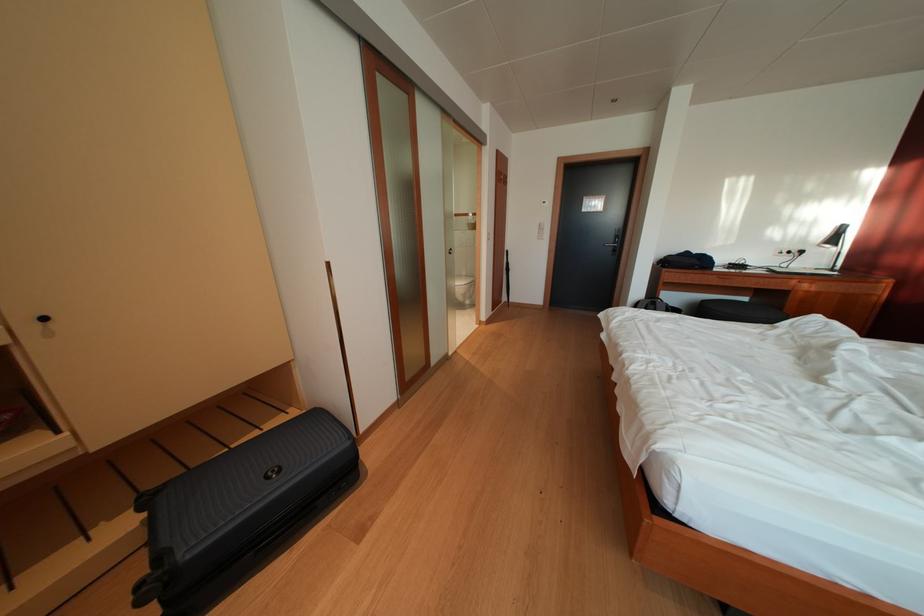
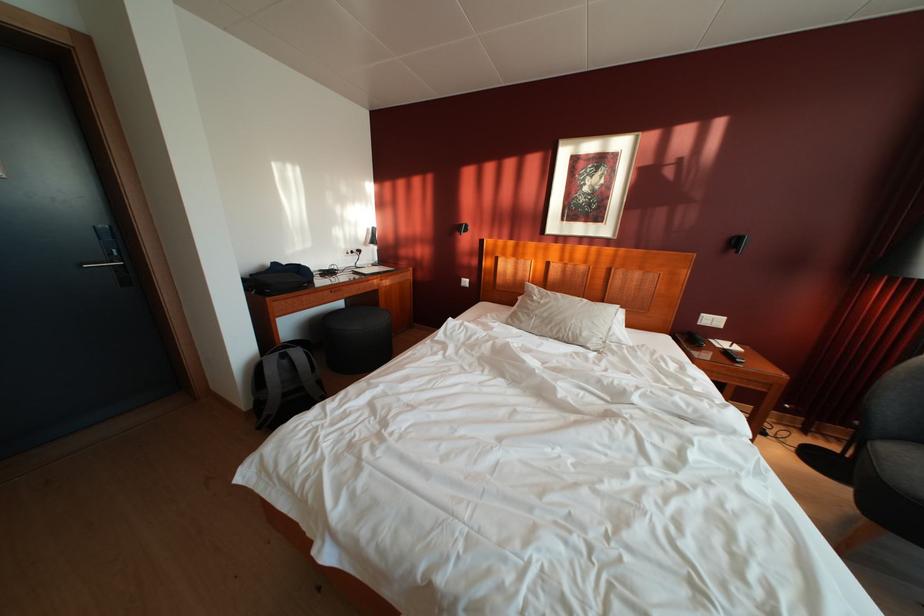
Where in the second image is the point corresponding to [662,310] from the first image?

(293, 362)